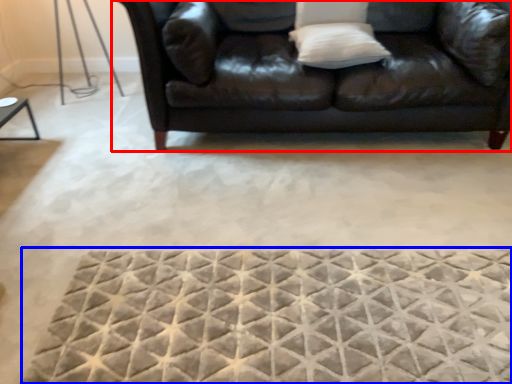
Question: Which point is closer to the camera, studio couch (highlighted by a red box) or mat (highlighted by a blue box)?

Choices:
 (A) studio couch
 (B) mat

Answer: (B)